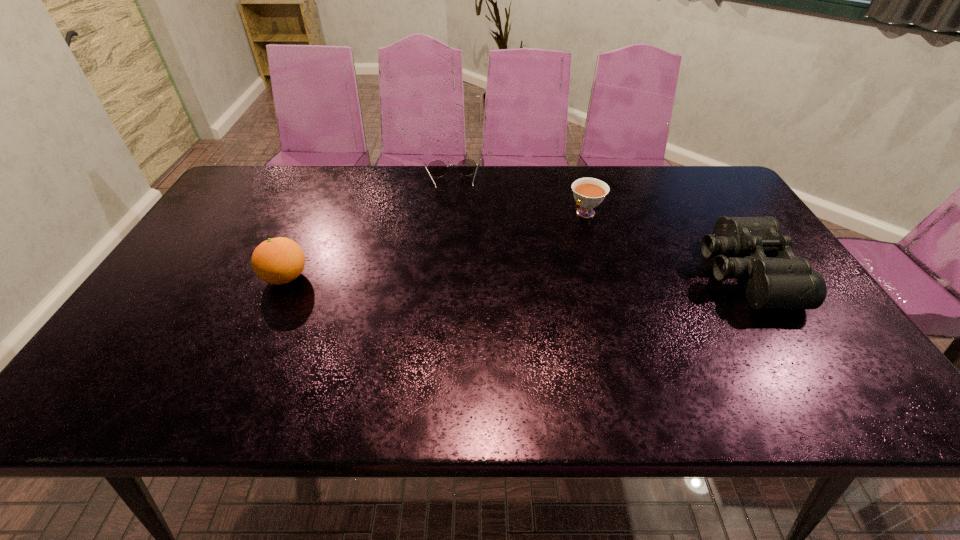
Find the location of `orange`. orange is located at coordinates (280, 260).

The width and height of the screenshot is (960, 540). Find the location of `the rightmost object`. the rightmost object is located at coordinates (786, 281).

Identify the location of the second object from right to left. The width and height of the screenshot is (960, 540). (589, 193).

Locate an element on the screen. The width and height of the screenshot is (960, 540). the second shortest object is located at coordinates (589, 193).

Locate an element on the screen. The height and width of the screenshot is (540, 960). the third object from right to left is located at coordinates (x=437, y=168).

What are the coordinates of `the farthest object` in the screenshot? It's located at (437, 168).

Where is `free space located 0.190m on the left of the orange`? The height and width of the screenshot is (540, 960). free space located 0.190m on the left of the orange is located at coordinates (189, 278).

Identify the location of vacant space located 0.140m on the side of the teacup with the handle. (550, 245).

This screenshot has height=540, width=960. In order to click on free region located on the side of the teacup with the handle in this screenshot , I will do `click(554, 241)`.

Locate an element on the screen. This screenshot has height=540, width=960. free space located on the side of the teacup with the handle is located at coordinates (495, 294).